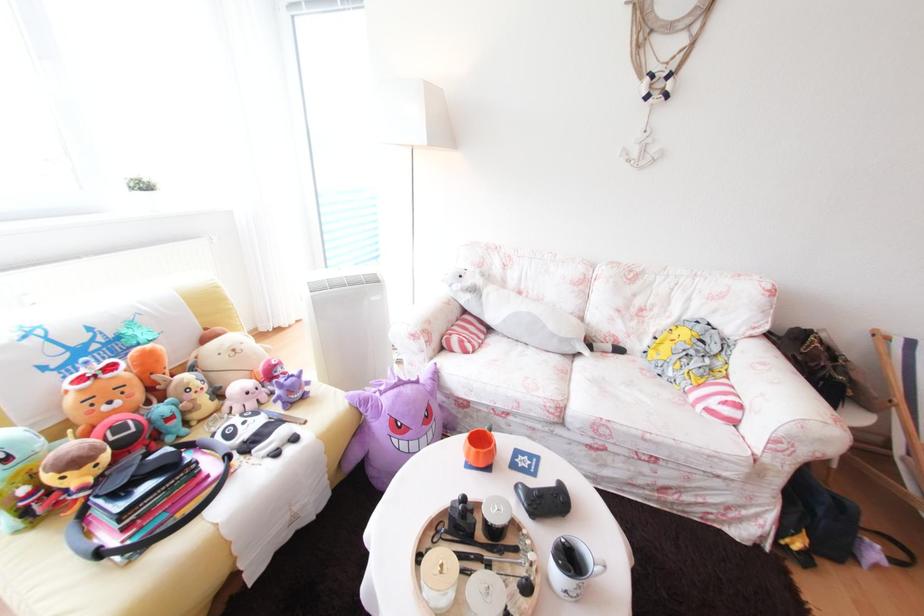
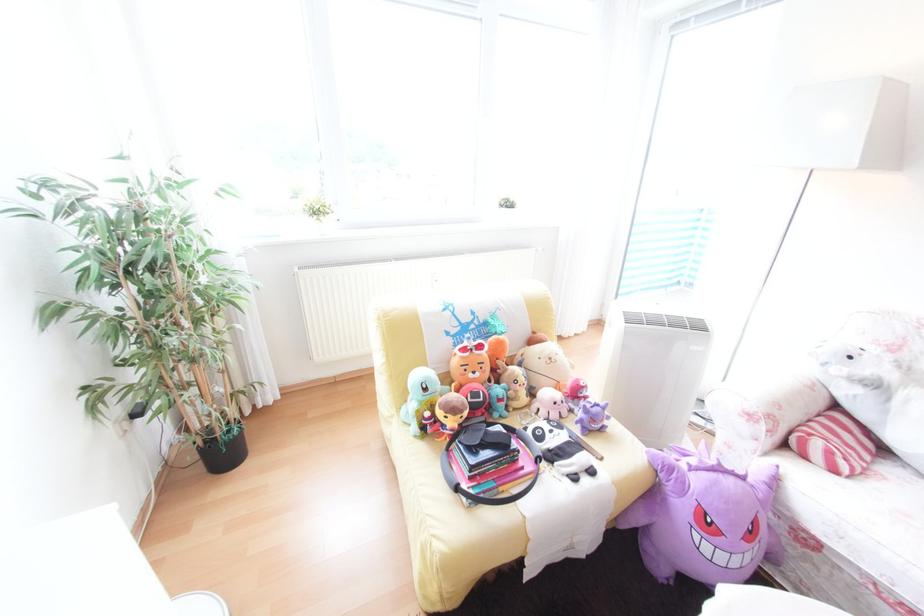
Where in the second image is the point corresponding to the point at 113,451 from the first image?

(476, 408)